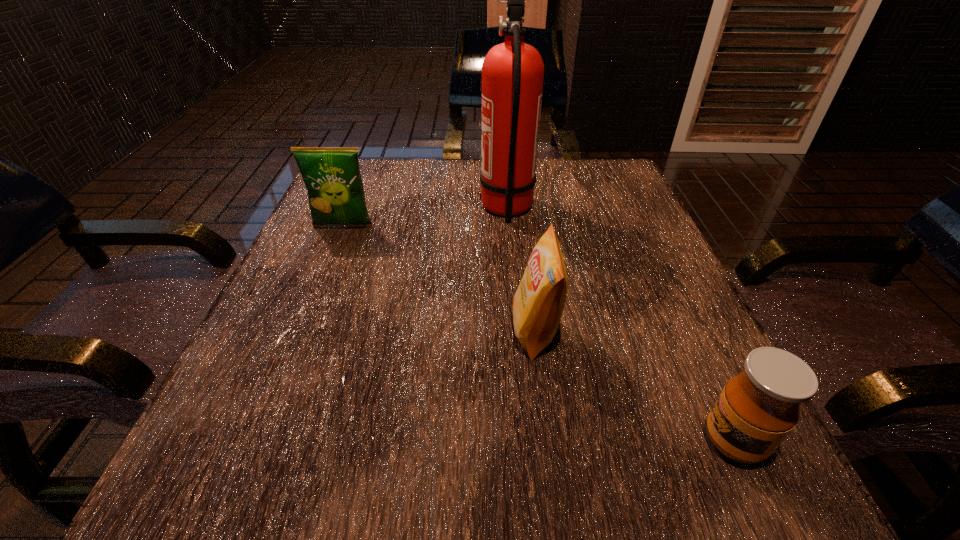
Find the location of a particular element. The height and width of the screenshot is (540, 960). object positioned at the right edge is located at coordinates (757, 409).

Locate an element on the screen. The height and width of the screenshot is (540, 960). object that is at the near right corner is located at coordinates (757, 409).

This screenshot has width=960, height=540. Find the location of `vacant region at the far edge of the desktop`. vacant region at the far edge of the desktop is located at coordinates (544, 169).

The width and height of the screenshot is (960, 540). I want to click on free spot at the left edge of the desktop, so click(x=325, y=280).

This screenshot has height=540, width=960. I want to click on blank space at the right edge of the desktop, so click(x=710, y=400).

The image size is (960, 540). I want to click on free space at the near left corner of the desktop, so click(263, 494).

Locate an element on the screen. vacant space at the far right corner of the desktop is located at coordinates (596, 165).

Find the location of a particular element. The width and height of the screenshot is (960, 540). vacant area at the near right corner of the desktop is located at coordinates (788, 494).

The image size is (960, 540). I want to click on vacant area that lies between the rightmost object and the third farthest object, so click(x=635, y=386).

Find the location of a particular element. The width and height of the screenshot is (960, 540). vacant point located between the nearer crisp (potato chip) and the nearest object is located at coordinates (635, 386).